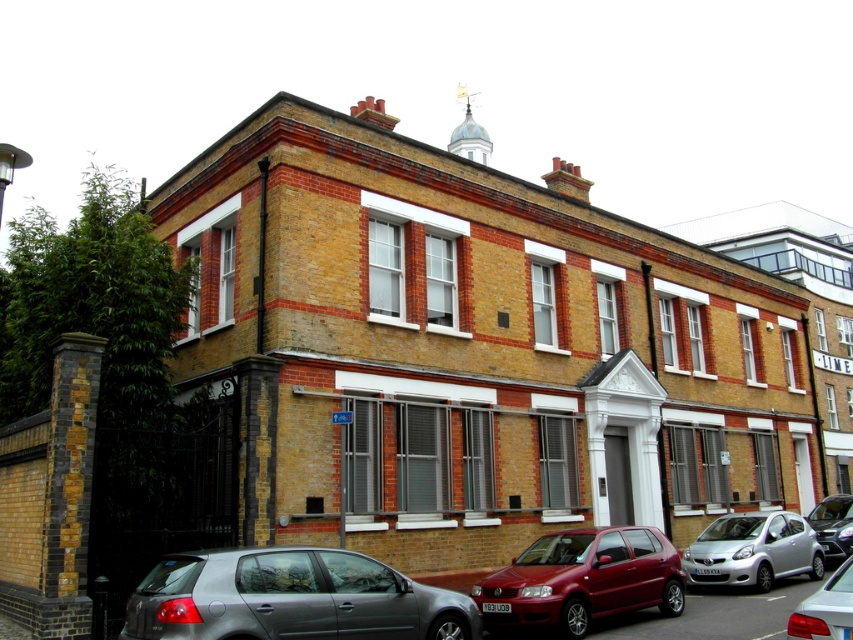
You are standing at the entrance of the two story brick building and want to park your car in the parking lot. The parking lot is located behind the building. You see a silver metallic hatchback at lower left represented by point (291, 598). Can you determine if the parking lot is behind the building based on the given coordinates?

The silver metallic hatchback at lower left is represented by point (291, 598). Since the parking lot is located behind the building, and the hatchback is at lower left coordinates, it is likely positioned in front of the building. Therefore, the parking lot is behind the building.

You are standing in front of the two story brick building. You notice two points marked on the building. The first point is at coordinate point (546, 602) and the second is at point (845, 518). Which point is closer to you?

Point (546, 602) is closer to the viewer than point (845, 518).